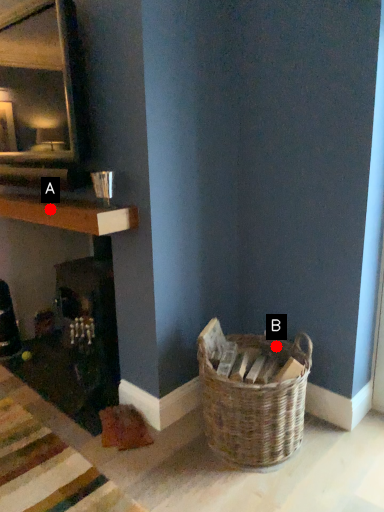
Question: Two points are circled on the image, labeled by A and B beside each circle. Which point is closer to the camera?

Choices:
 (A) A is closer
 (B) B is closer

Answer: (A)